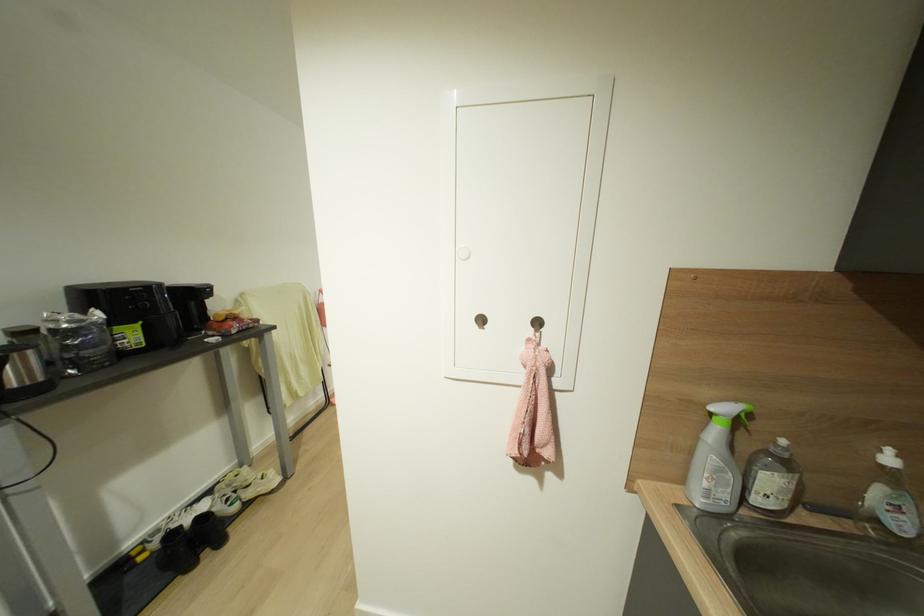
Where would you push the white bottle pump? Please return your answer as a coordinate pair (x, y).

(715, 461)